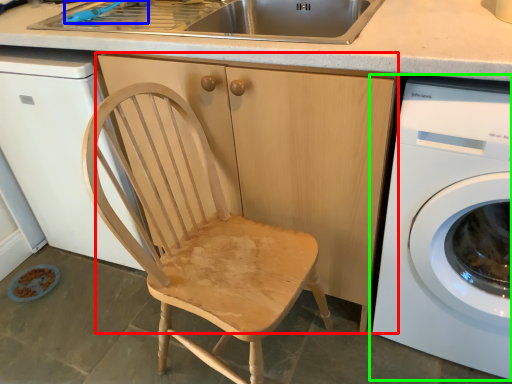
Question: Estimate the real-world distances between objects in this image. Which object is farther from cabinetry (highlighted by a red box), faucet (highlighted by a blue box) or washing machine (highlighted by a green box)?

Choices:
 (A) faucet
 (B) washing machine

Answer: (A)